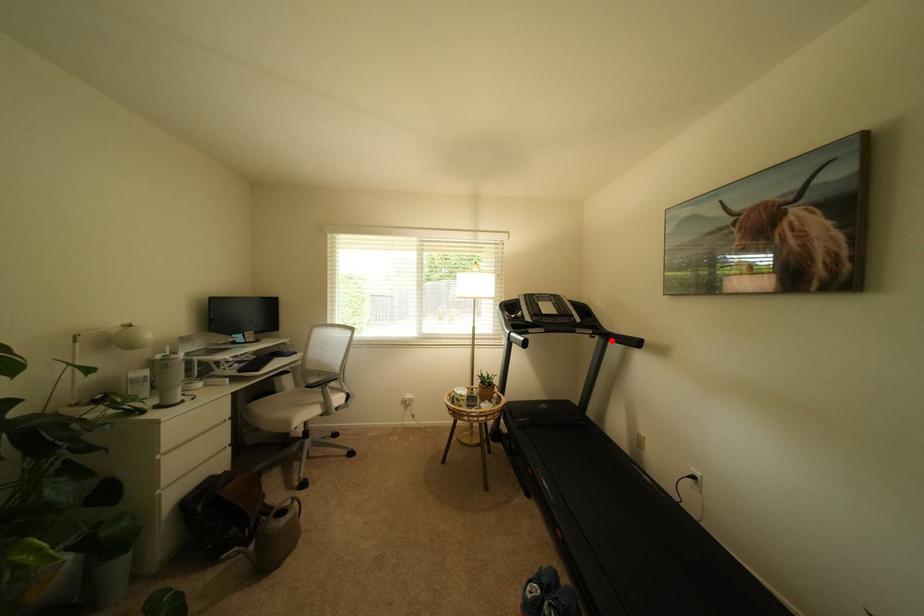
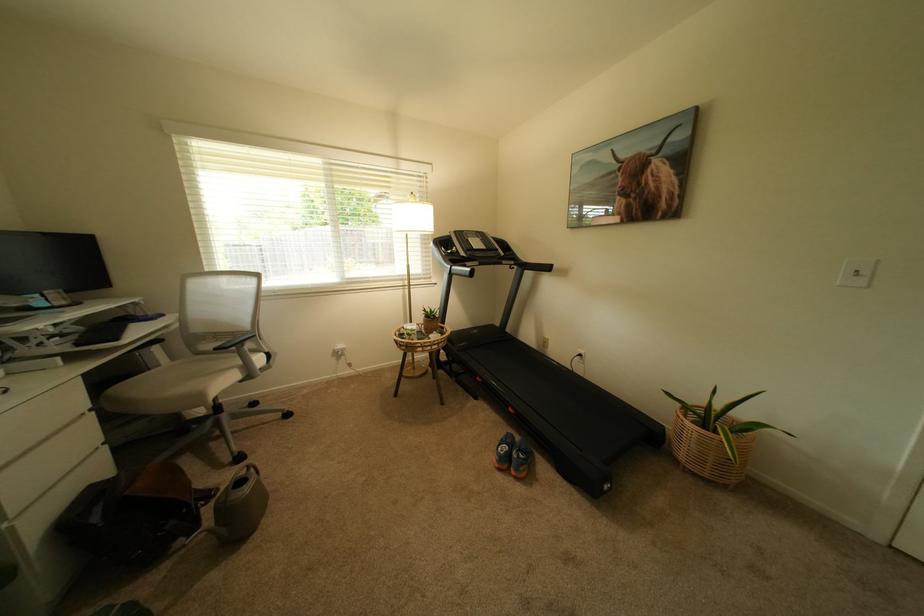
Find the pixel in the second image that matches the highlighted location in the first image.

(529, 270)